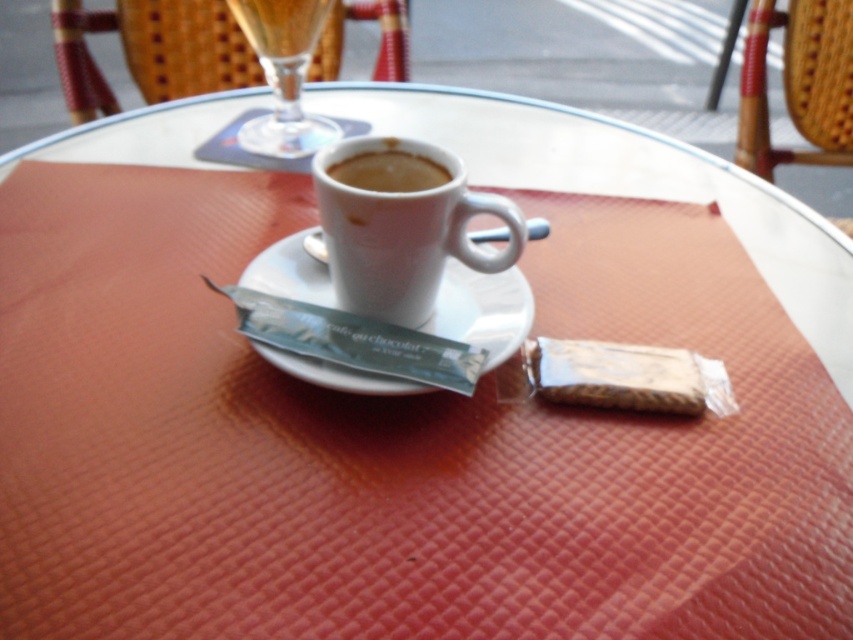
You are sitting at the table in the cozy cafe and want to grab your drink. Which object, the woven wood chair at upper left or the clear glass at upper center, is located to the left of the other?

The woven wood chair at upper left is positioned on the left side of clear glass at upper center.

You are sitting at the table in the image and want to reach both the point at coordinates (807, 52) and the point at coordinates (370, 180). Which point will you reach first?

You will reach the point at coordinates (807, 52) first because it is closer to you than the point at coordinates (370, 180), which is further away.

You are standing at the entrance of the cafe and want to sit in the woven wicker chair at upper right. Based on the coordinates provided, can you estimate the direction you should walk to reach it?

The woven wicker chair at upper right is located at coordinates point (798, 83), which means it is positioned at the upper right corner of the image. To reach it, you should walk towards the upper right direction from your current position at the entrance.